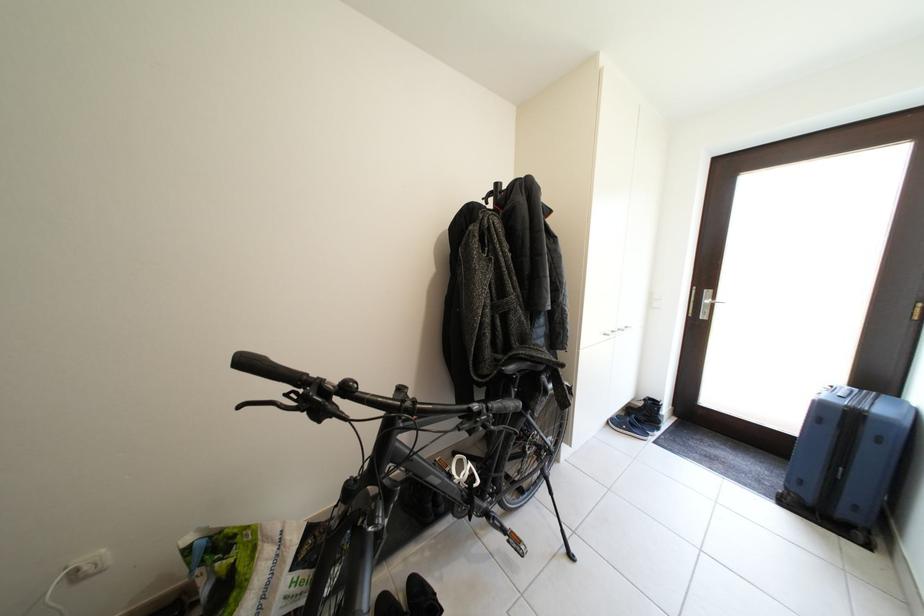
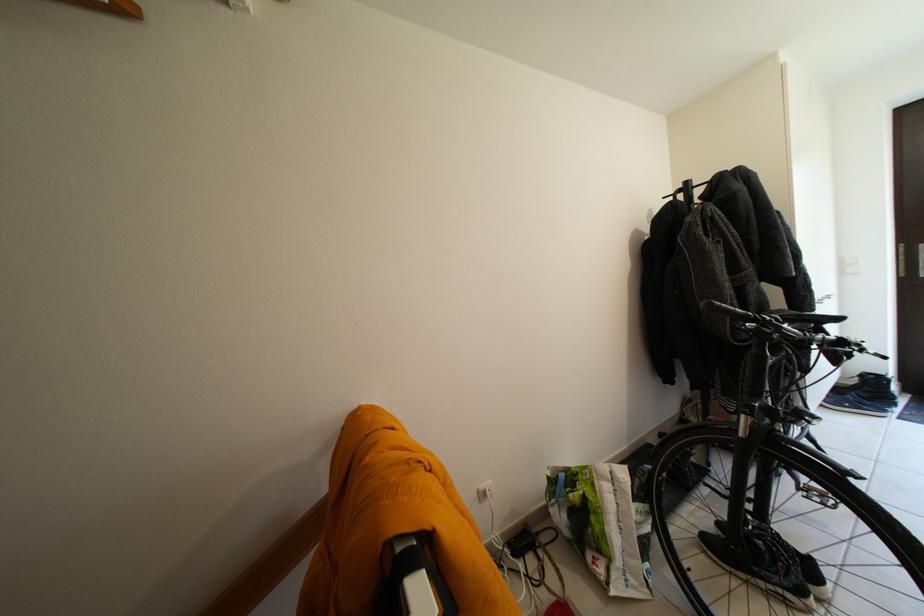
Where in the second image is the point corresponding to pixel 478 415 from the first image?

(849, 344)